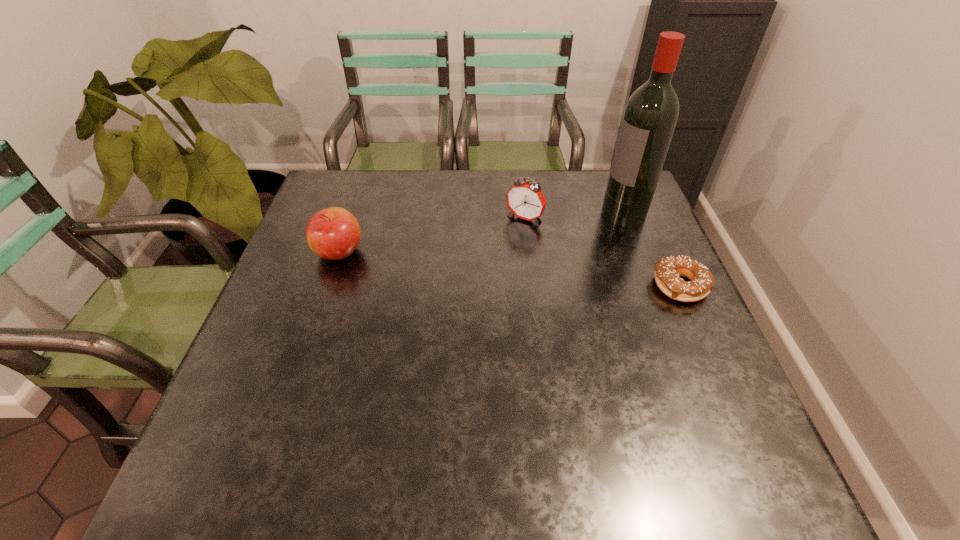
Find the location of a particular element. The width and height of the screenshot is (960, 540). free space located 0.050m on the clock face of the third object from right to left is located at coordinates (508, 236).

Where is `blank space located 0.100m on the clock face of the third object from right to left`? The image size is (960, 540). blank space located 0.100m on the clock face of the third object from right to left is located at coordinates (500, 247).

I want to click on wine bottle at the far edge, so click(649, 120).

Identify the location of alarm clock that is positioned at the far edge. (525, 200).

The height and width of the screenshot is (540, 960). I want to click on object located at the left edge, so click(x=333, y=233).

Locate an element on the screen. The height and width of the screenshot is (540, 960). doughnut that is at the right edge is located at coordinates (668, 270).

Locate an element on the screen. This screenshot has height=540, width=960. wine bottle positioned at the right edge is located at coordinates (649, 120).

This screenshot has height=540, width=960. Identify the location of object that is at the far right corner. (649, 120).

You are a GUI agent. You are given a task and a screenshot of the screen. Output one action in this format:
    pyautogui.click(x=<x>, y=<y>)
    Task: Click on the free space at the far edge
    The width and height of the screenshot is (960, 540).
    Given the screenshot: What is the action you would take?
    pyautogui.click(x=428, y=180)

You are a GUI agent. You are given a task and a screenshot of the screen. Output one action in this format:
    pyautogui.click(x=<x>, y=<y>)
    Task: Click on the free space at the left edge of the desktop
    This screenshot has height=540, width=960.
    Given the screenshot: What is the action you would take?
    pyautogui.click(x=275, y=363)